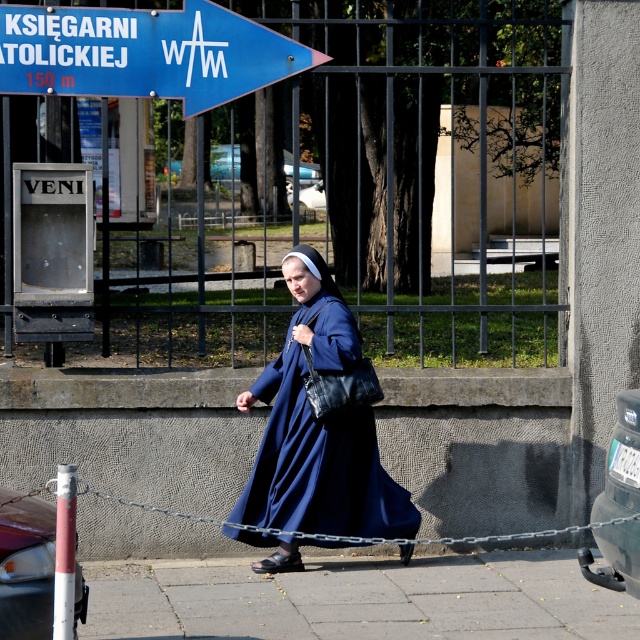
Question: Which of these objects is positioned closest to the blue matte dress at center?

Choices:
 (A) blue plastic sign at upper center
 (B) metallic silver chain at lower center

Answer: (B)

Question: Considering the relative positions of gray concrete pavement at lower center and blue plastic sign at upper center in the image provided, where is gray concrete pavement at lower center located with respect to blue plastic sign at upper center?

Choices:
 (A) right
 (B) left

Answer: (A)

Question: Can you confirm if blue matte dress at center is positioned to the right of metallic silver chain at lower center?

Choices:
 (A) yes
 (B) no

Answer: (B)

Question: Does blue plastic sign at upper center have a smaller size compared to metallic silver chain at lower center?

Choices:
 (A) yes
 (B) no

Answer: (B)

Question: Which point is farther from the camera taking this photo?

Choices:
 (A) (625, 516)
 (B) (230, 22)
 (C) (310, 355)
 (D) (404, 598)

Answer: (B)

Question: Which point is closer to the camera taking this photo?

Choices:
 (A) (68, 67)
 (B) (390, 602)
 (C) (136, 502)

Answer: (B)